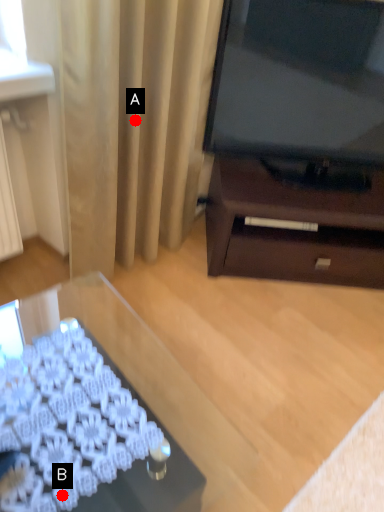
Question: Two points are circled on the image, labeled by A and B beside each circle. Which point is farther to the camera?

Choices:
 (A) A is further
 (B) B is further

Answer: (A)